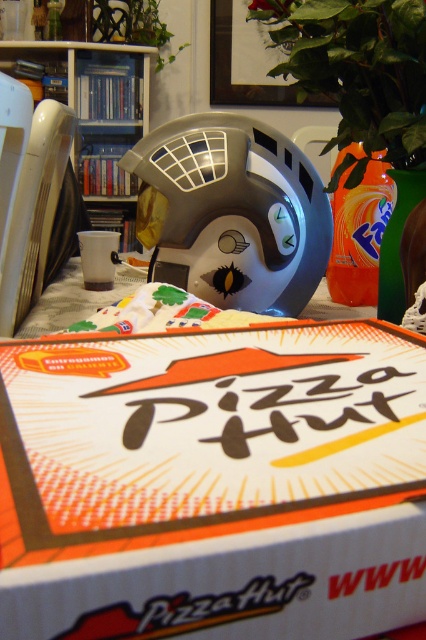
Question: Which of these objects is positioned closest to the green leafy plant at upper center?

Choices:
 (A) green leafy plant at upper right
 (B) matte plastic helmet at center
 (C) white cardboard pizza hut box at center
 (D) matte plastic bookshelf at upper left

Answer: (D)

Question: Can you confirm if white cardboard pizza hut box at center is positioned below green leafy plant at upper center?

Choices:
 (A) yes
 (B) no

Answer: (A)

Question: Is the position of green leafy plant at upper right more distant than that of green leafy plant at upper center?

Choices:
 (A) yes
 (B) no

Answer: (B)

Question: Is matte plastic helmet at center wider than green leafy plant at upper right?

Choices:
 (A) yes
 (B) no

Answer: (A)

Question: Which point is closer to the camera taking this photo?

Choices:
 (A) (124, 225)
 (B) (328, 29)
 (C) (308, 225)

Answer: (B)

Question: Which of the following is the closest to the observer?

Choices:
 (A) (154, 10)
 (B) (9, 360)
 (C) (259, 204)
 (D) (342, 38)

Answer: (B)